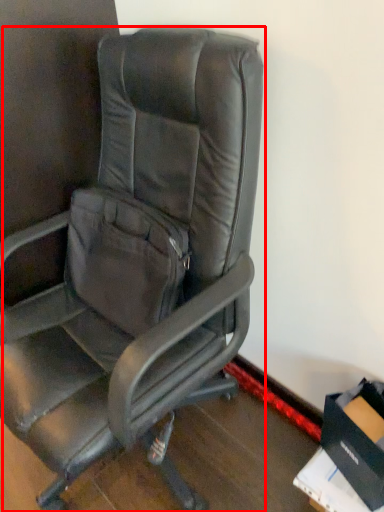
Question: In this image, where is chair (annotated by the red box) located relative to cardboard box?

Choices:
 (A) left
 (B) right

Answer: (A)